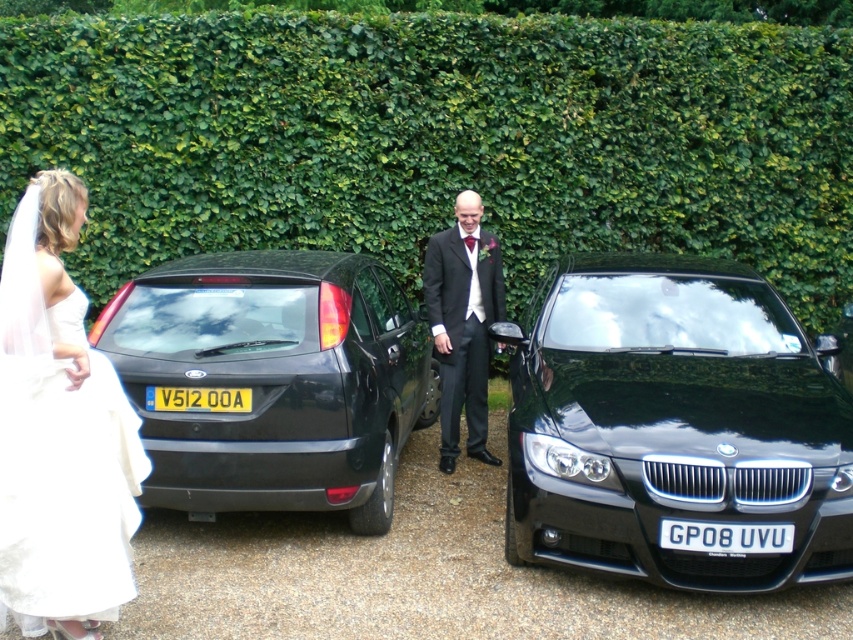
You are a photographer at a wedding. You need to capture a photo that includes both the black metallic car at center and the matte black suit at center. Which object should you focus on first to ensure it fits in the frame?

The black metallic car at center is shorter than the matte black suit at center, so you should focus on the matte black suit at center first to ensure it fits in the frame.

You are a photographer at a wedding. You need to place a bouquet at the point that is exactly in the center of the image. The image has a coordinate system where the bottom left corner is the origin. The center of the image is at point (463,323). You have two bouquets to choose from. One is a white bouquet with red roses, and the other is a matte black bouquet. According to the scene description, which bouquet should you place at the center point to match the existing elements?

The point at (463,323) already has a matte black suit at center. Therefore, to match the existing elements, you should place the matte black bouquet at the center point.